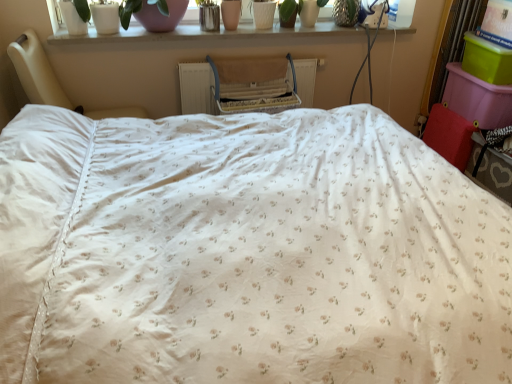
Question: From the image's perspective, does white floral fabric bed at center appear higher than white plastic radiator at center?

Choices:
 (A) yes
 (B) no

Answer: (B)

Question: Is white floral fabric bed at center facing away from white plastic radiator at center?

Choices:
 (A) yes
 (B) no

Answer: (B)

Question: Would you say white floral fabric bed at center is outside white plastic radiator at center?

Choices:
 (A) no
 (B) yes

Answer: (B)

Question: Is white floral fabric bed at center positioned far away from white plastic radiator at center?

Choices:
 (A) yes
 (B) no

Answer: (A)

Question: Is white floral fabric bed at center thinner than white plastic radiator at center?

Choices:
 (A) yes
 (B) no

Answer: (B)

Question: Is white fabric bed at left spatially inside pink glass vase at upper center, or outside of it?

Choices:
 (A) outside
 (B) inside

Answer: (A)

Question: From a real-world perspective, is white fabric bed at left physically located above or below pink glass vase at upper center?

Choices:
 (A) above
 (B) below

Answer: (B)

Question: Looking at their shapes, would you say white fabric bed at left is wider or thinner than pink glass vase at upper center?

Choices:
 (A) wide
 (B) thin

Answer: (A)

Question: Is point (55, 94) positioned closer to the camera than point (155, 21)?

Choices:
 (A) closer
 (B) farther

Answer: (A)

Question: Considering the positions of pink glass vase at upper center and white plastic radiator at center in the image, is pink glass vase at upper center wider or thinner than white plastic radiator at center?

Choices:
 (A) wide
 (B) thin

Answer: (A)

Question: From the image's perspective, relative to white plastic radiator at center, is pink glass vase at upper center above or below?

Choices:
 (A) above
 (B) below

Answer: (A)

Question: Considering the positions of point (170, 16) and point (282, 100), is point (170, 16) closer or farther from the camera than point (282, 100)?

Choices:
 (A) closer
 (B) farther

Answer: (A)

Question: In the image, is pink glass vase at upper center on the left side or the right side of white plastic radiator at center?

Choices:
 (A) left
 (B) right

Answer: (A)

Question: From a real-world perspective, relative to white painted wood at upper center, is white fabric bed at left vertically above or below?

Choices:
 (A) below
 (B) above

Answer: (A)

Question: Considering the positions of white fabric bed at left and white painted wood at upper center in the image, is white fabric bed at left wider or thinner than white painted wood at upper center?

Choices:
 (A) thin
 (B) wide

Answer: (B)